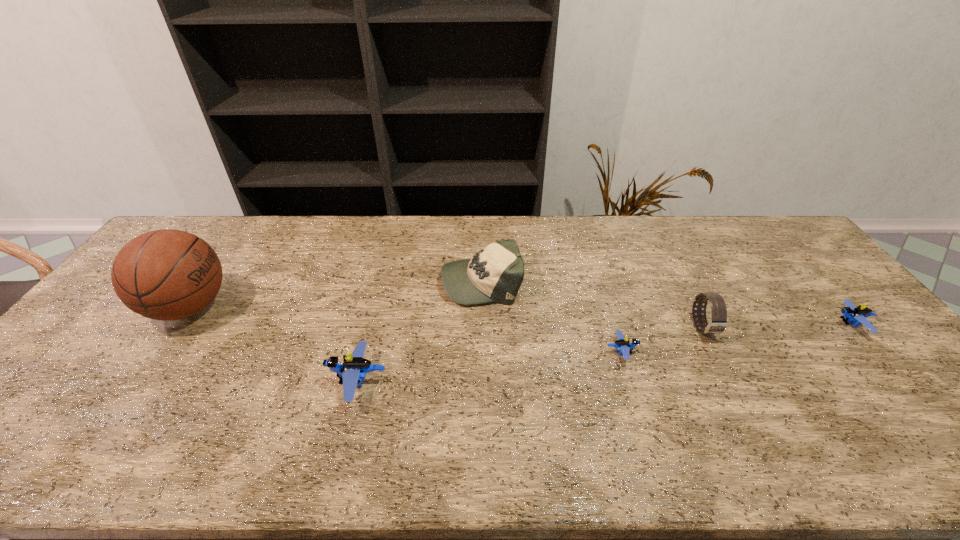
Please show where to add a Lego on the left while keeping spacing even. Please provide its 2D coordinates. Your answer should be formatted as a tuple, i.e. [(x, y)], where the tuple contains the x and y coordinates of a point satisfying the conditions above.

[(58, 417)]